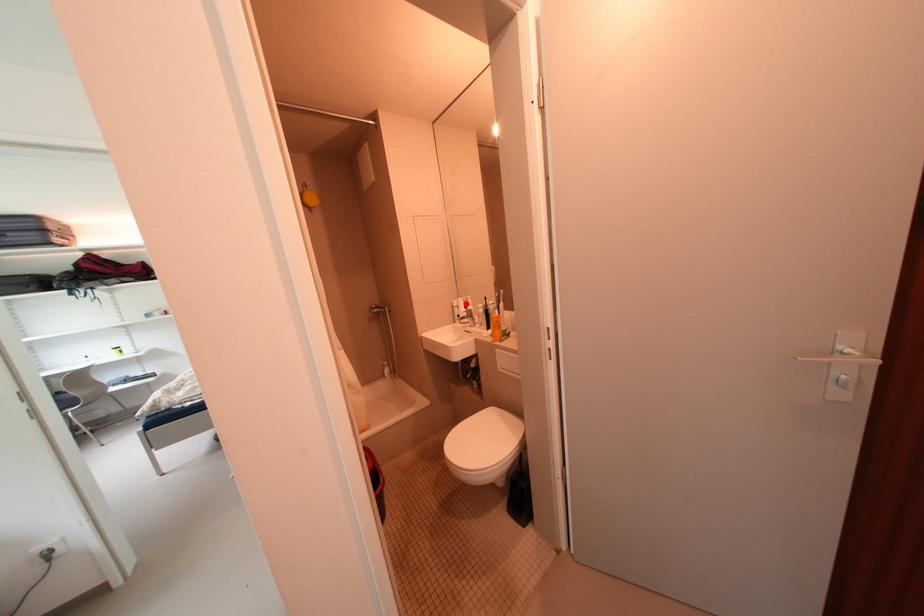
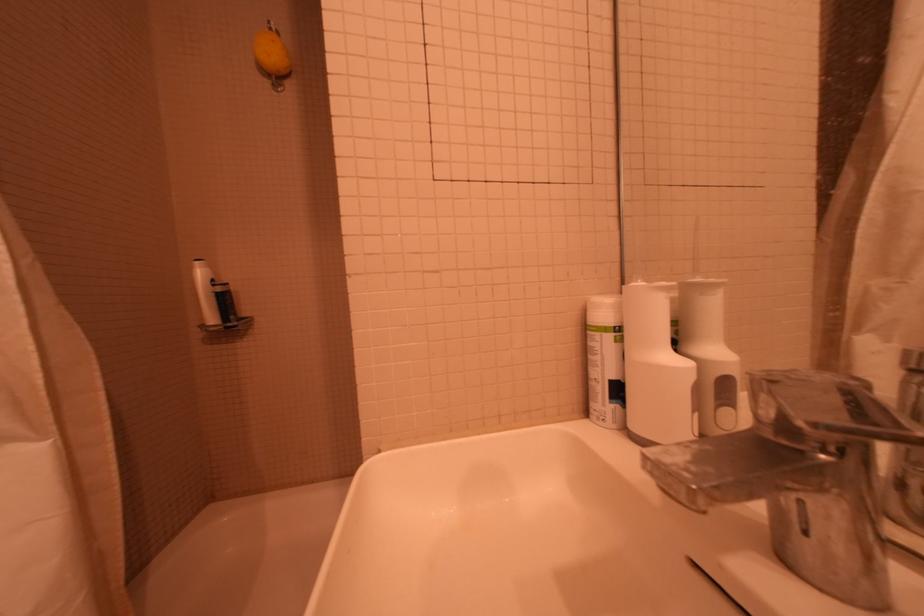
Question: I am providing you with two images of the same scene from different viewpoints. A red point is marked on the first image. Can you still see the location of the red point in image 2?

Choices:
 (A) Yes
 (B) No

Answer: (A)